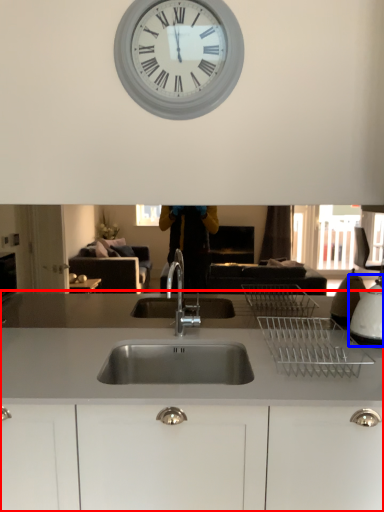
Question: Which object appears farthest to the camera in this image, countertop (highlighted by a red box) or appliance (highlighted by a blue box)?

Choices:
 (A) countertop
 (B) appliance

Answer: (B)